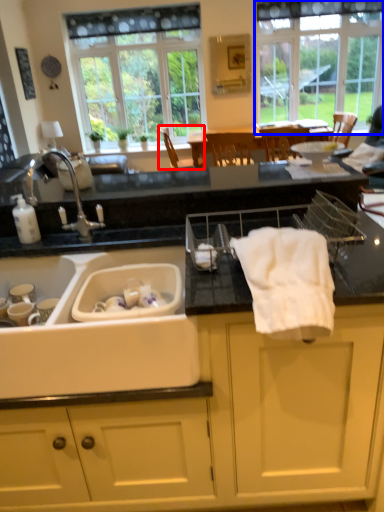
Question: Which point is closer to the camera, chair (highlighted by a red box) or window (highlighted by a blue box)?

Choices:
 (A) chair
 (B) window

Answer: (A)